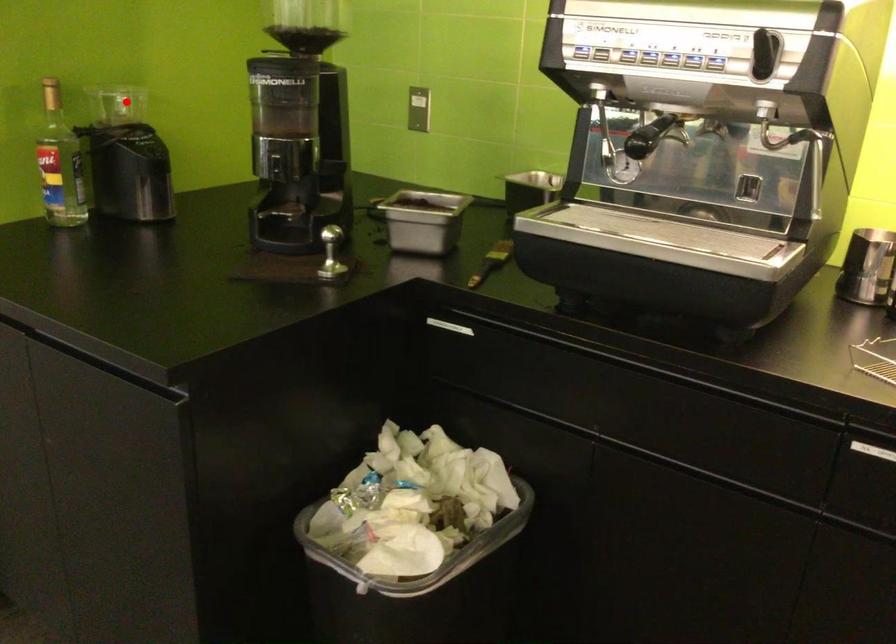
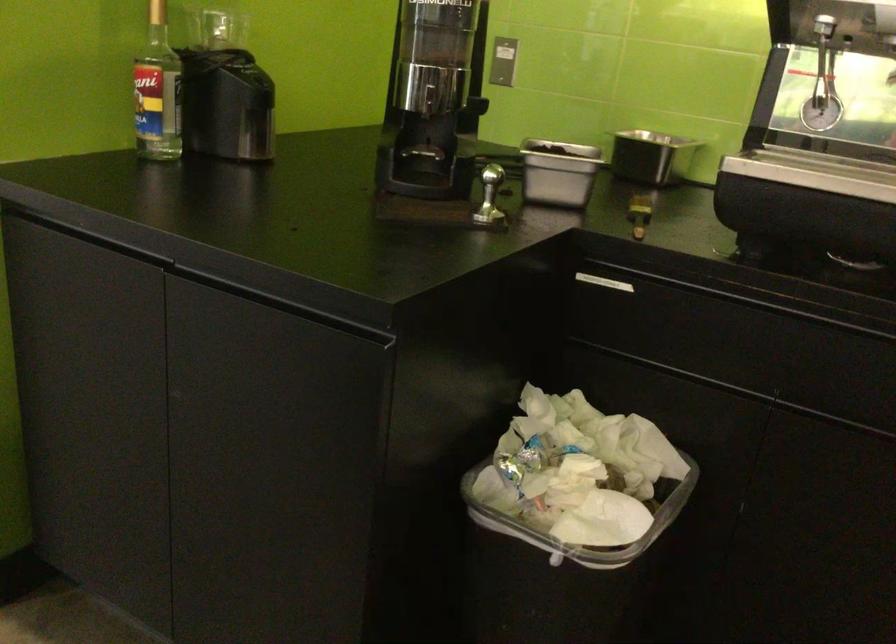
In the second image, find the point that corresponds to the highlighted location in the first image.

(216, 29)